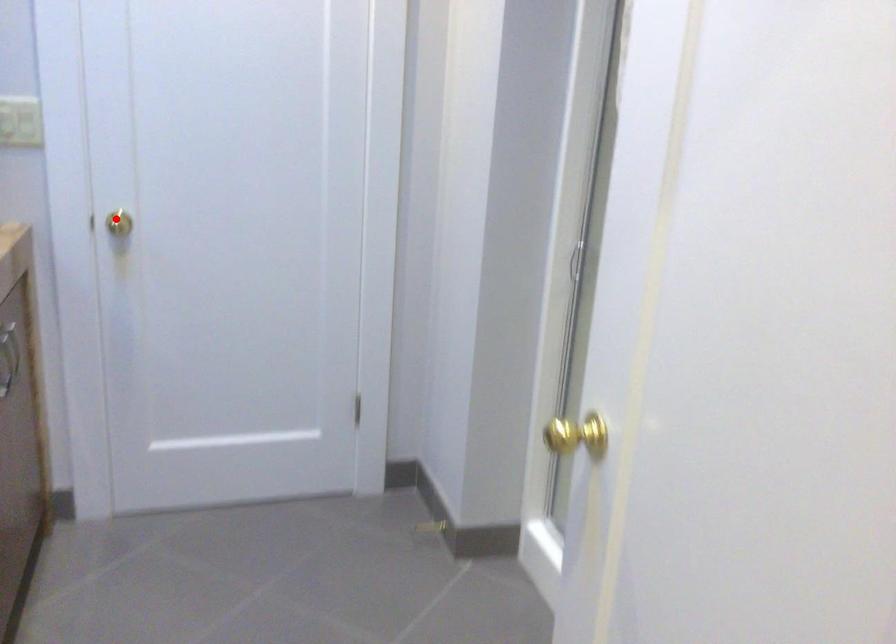
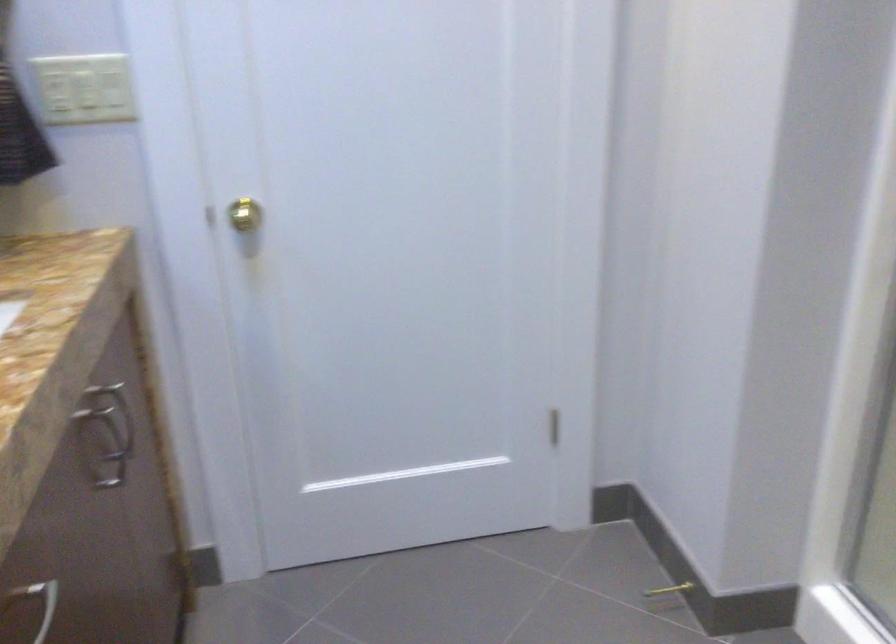
In the second image, find the point that corresponds to the highlighted location in the first image.

(240, 214)